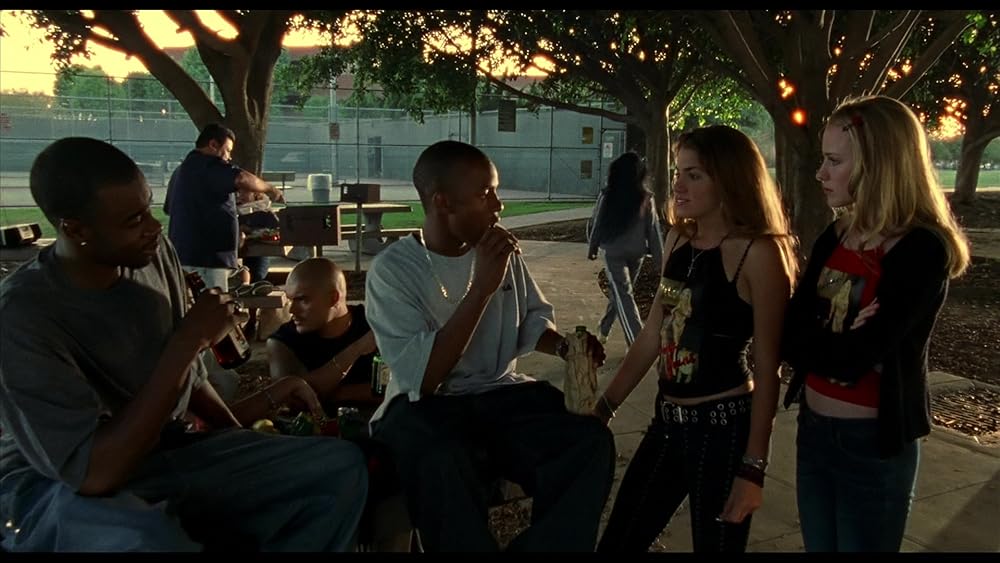
Where is `bottle`? The height and width of the screenshot is (563, 1000). bottle is located at coordinates (578, 364).